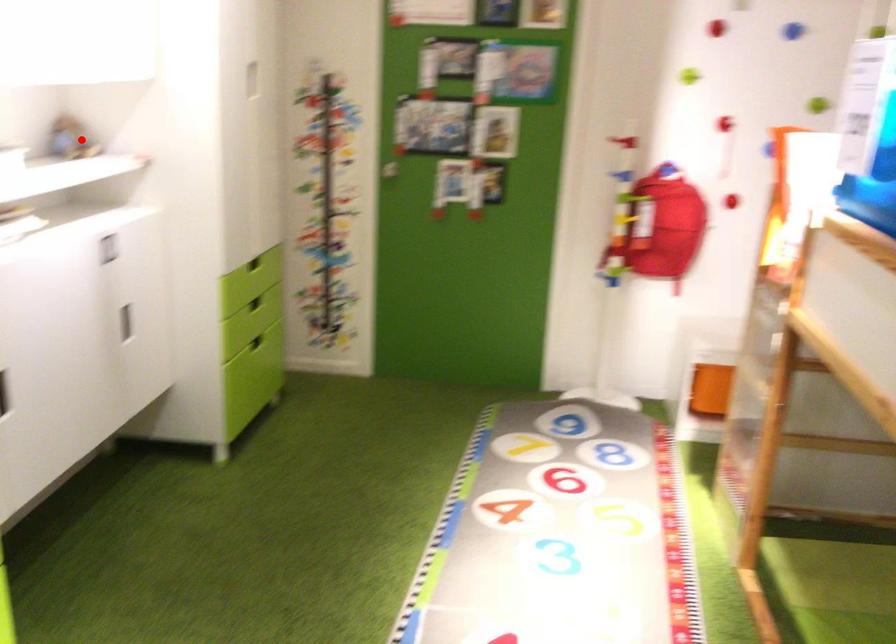
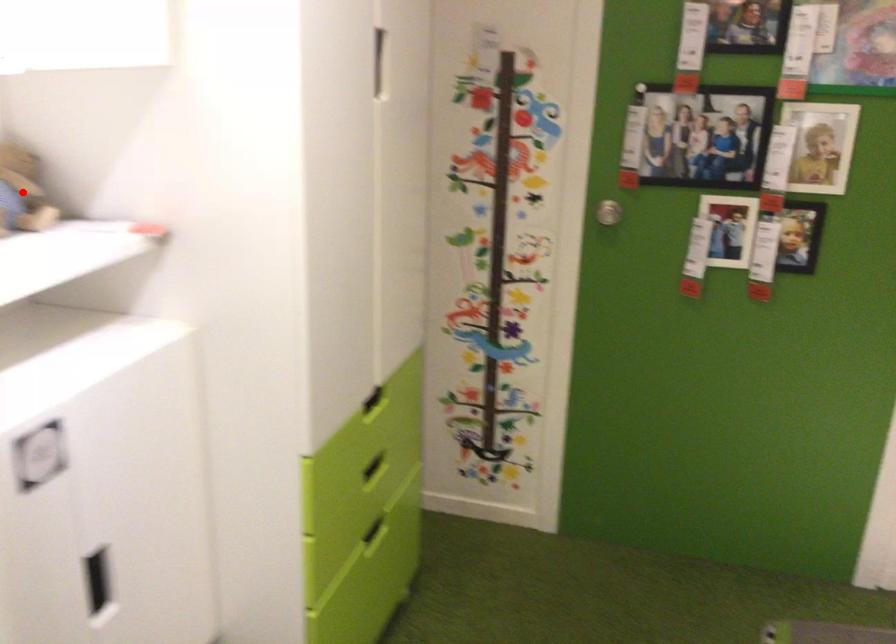
I am providing you with two images of the same scene from different viewpoints. A red point is marked on the first image and another point is marked on the second image. Are the points marked in image1 and image2 representing the same 3D position?

Yes